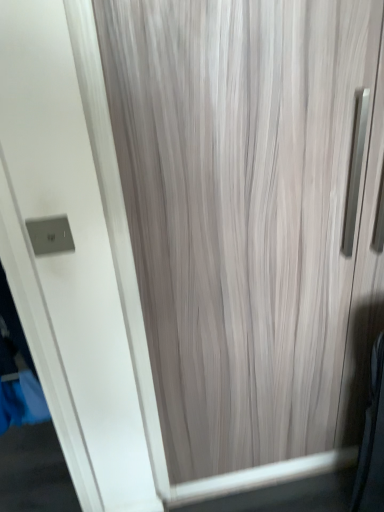
Question: Is point (62, 226) closer or farther from the camera than point (360, 352)?

Choices:
 (A) farther
 (B) closer

Answer: (B)

Question: In the image, is satin silver switch at upper left on the left side or the right side of wooden door at center?

Choices:
 (A) right
 (B) left

Answer: (B)

Question: From the image's perspective, is satin silver switch at upper left above or below wooden door at center?

Choices:
 (A) below
 (B) above

Answer: (B)

Question: Do you think wooden door at center is within satin silver switch at upper left, or outside of it?

Choices:
 (A) inside
 (B) outside

Answer: (B)

Question: From the image's perspective, is wooden door at center above or below satin silver switch at upper left?

Choices:
 (A) below
 (B) above

Answer: (A)

Question: From a real-world perspective, is wooden door at center physically located above or below satin silver switch at upper left?

Choices:
 (A) below
 (B) above

Answer: (A)

Question: Would you say wooden door at center is to the left or to the right of satin silver switch at upper left in the picture?

Choices:
 (A) left
 (B) right

Answer: (B)